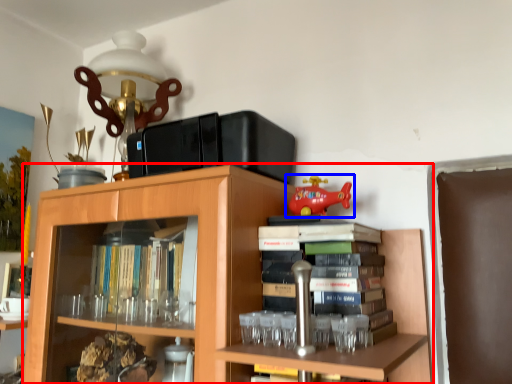
Question: Which point is closer to the camera, bookcase (highlighted by a red box) or toy (highlighted by a blue box)?

Choices:
 (A) bookcase
 (B) toy

Answer: (A)